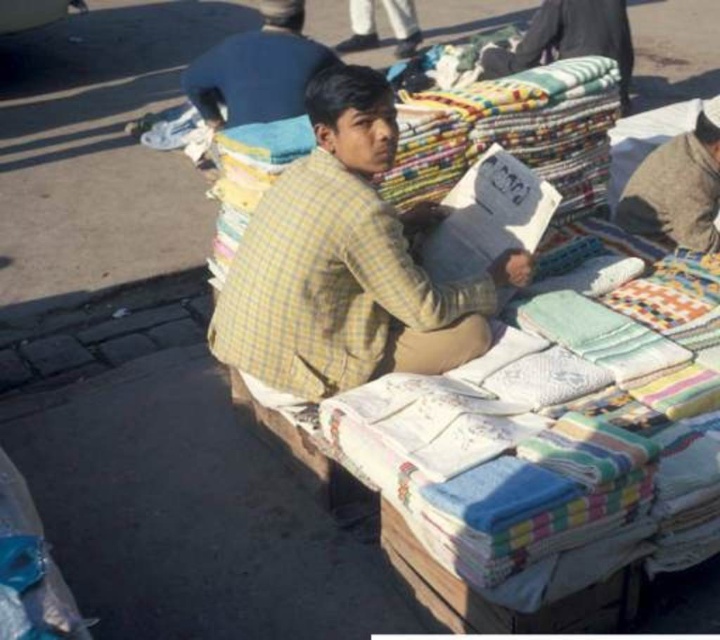
Question: Which is nearer to the gray woolen hat at upper right?

Choices:
 (A) light blue fabric at upper center
 (B) multicolored fabric at upper right
 (C) yellow checkered shirt at center
 (D) light blue shirt at center

Answer: (C)

Question: Is yellow checkered shirt at center to the left of light blue shirt at center from the viewer's perspective?

Choices:
 (A) no
 (B) yes

Answer: (A)

Question: Based on their relative distances, which object is farther from the light blue fabric at upper center?

Choices:
 (A) yellow checkered shirt at center
 (B) multicolored fabric at upper right
 (C) light blue shirt at center

Answer: (A)

Question: Does yellow checkered shirt at center have a smaller size compared to light blue fabric at upper center?

Choices:
 (A) yes
 (B) no

Answer: (B)

Question: Which point is farther to the camera?

Choices:
 (A) yellow checkered shirt at center
 (B) light blue fabric at upper center
 (C) multicolored fabric at upper right

Answer: (B)

Question: Does yellow checkered shirt at center have a smaller size compared to light blue shirt at center?

Choices:
 (A) yes
 (B) no

Answer: (B)